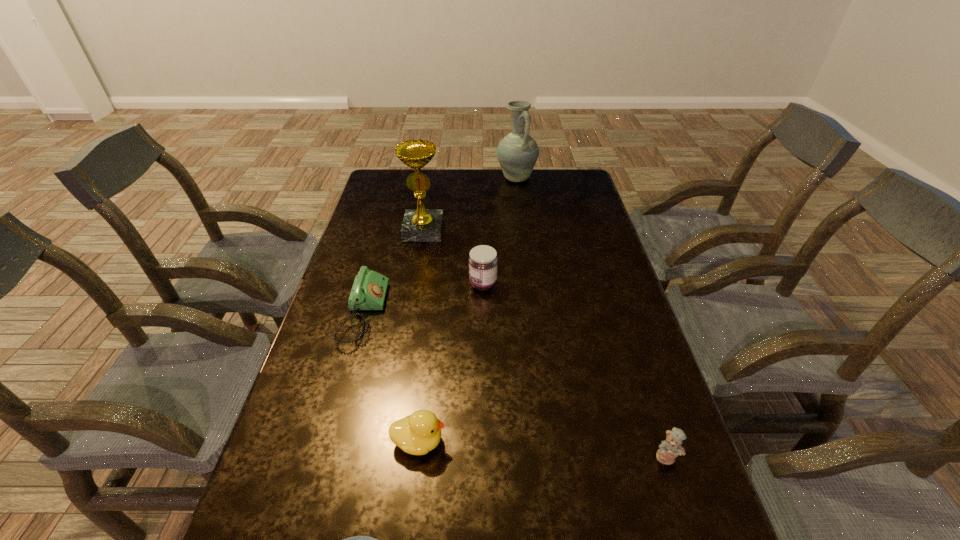
Image resolution: width=960 pixels, height=540 pixels. What are the coordinates of `pitcher` in the screenshot? It's located at (517, 153).

Locate an element on the screen. the farthest object is located at coordinates (517, 153).

Where is `the sixth nearest object`? The height and width of the screenshot is (540, 960). the sixth nearest object is located at coordinates (419, 225).

You are a GUI agent. You are given a task and a screenshot of the screen. Output one action in this format:
    pyautogui.click(x=<x>, y=<y>)
    Task: Click on the third tallest object
    
    Given the screenshot: What is the action you would take?
    (x=483, y=260)

This screenshot has width=960, height=540. What are the coordinates of `the fifth object from left to right` in the screenshot? It's located at (483, 260).

Locate an element on the screen. The height and width of the screenshot is (540, 960). duckling is located at coordinates (417, 434).

The image size is (960, 540). I want to click on teddy bear, so click(x=669, y=449).

This screenshot has height=540, width=960. What are the coordinates of `telephone` in the screenshot? It's located at (369, 289).

Locate an element on the screen. Image resolution: width=960 pixels, height=540 pixels. free space located on the handle side of the sixth object from left to right is located at coordinates (522, 228).

At what (x,y) coordinates should I click in order to perform the action: click on free space located 0.200m on the front-facing side of the award. Please return your answer as a coordinate pair (x, y). Looking at the image, I should click on (415, 280).